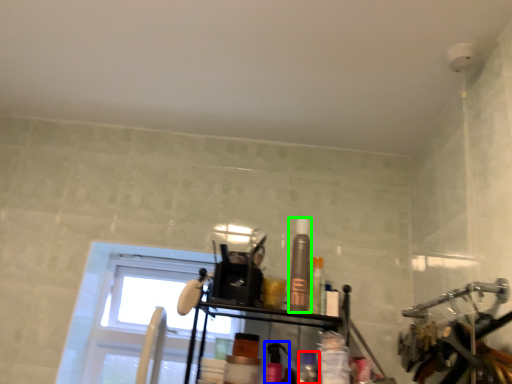
Question: Which is farther away from toiletry (highlighted by a red box)? toiletry (highlighted by a blue box) or toiletry (highlighted by a green box)?

Choices:
 (A) toiletry
 (B) toiletry

Answer: (B)